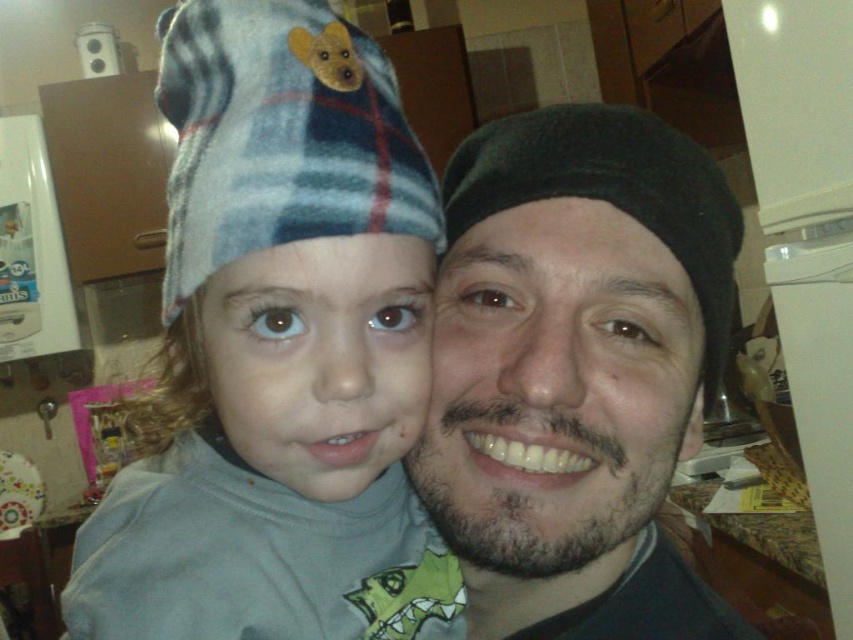
Is point (120, 508) closer to viewer compared to point (495, 467)?

No, (120, 508) is behind (495, 467).

Does fluffy fleece hat at upper left have a greater height compared to black matte beret at center?

Yes.

The width and height of the screenshot is (853, 640). Identify the location of fluffy fleece hat at upper left. (279, 353).

Is fluffy fleece hat at upper left taller than plaid flannel hat at upper left?

Correct, fluffy fleece hat at upper left is much taller as plaid flannel hat at upper left.

Looking at this image, can you confirm if fluffy fleece hat at upper left is shorter than plaid flannel hat at upper left?

No, fluffy fleece hat at upper left is not shorter than plaid flannel hat at upper left.

Which is behind, point (270, 99) or point (323, 32)?

The point (323, 32) is behind.

The image size is (853, 640). Identify the location of fluffy fleece hat at upper left. (279, 353).

In the scene shown: Which is above, black matte beret at center or plaid flannel hat at upper left?

plaid flannel hat at upper left is above.

Between black matte beret at center and plaid flannel hat at upper left, which one has more height?

With more height is black matte beret at center.

Who is more forward, [633,570] or [192,129]?

Positioned in front is point [192,129].

Image resolution: width=853 pixels, height=640 pixels. Identify the location of black matte beret at center. (575, 371).